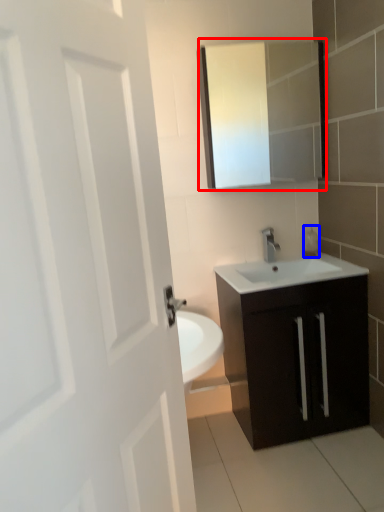
Question: Which point is further to the camera, medicine cabinet (highlighted by a red box) or soap dispenser (highlighted by a blue box)?

Choices:
 (A) medicine cabinet
 (B) soap dispenser

Answer: (B)